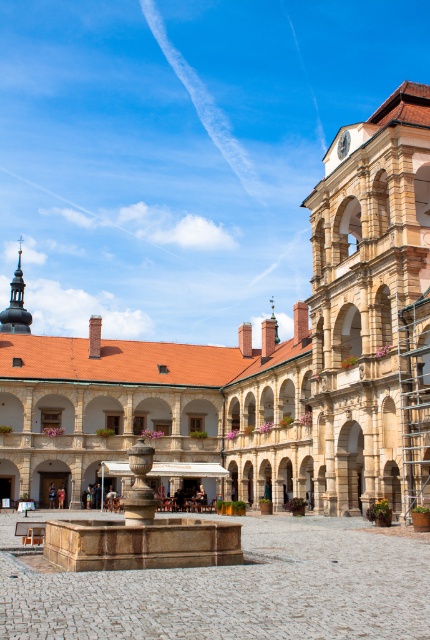
You are standing in the courtyard of the beige stone palace at center. You want to take a photo of the palace from a distance that is exactly 50 meters away. Is the current position you are standing at sufficient to achieve this?

The beige stone palace at center is 48.62 meters from camera, so you are already closer than 50 meters. To get exactly 50 meters away, you need to move back approximately 1.38 meters.

You are a tour guide leading a group through the courtyard. You want to ensure everyone can comfortably walk from the beige stone palace at center to the marble fountain at center. The widest wheelchair in your group is 32 inches wide. Is the path between them wide enough?

The distance between the beige stone palace at center and the marble fountain at center is 70.59 feet, which is approximately 847 inches. Since the widest wheelchair is only 32 inches wide, the path is more than sufficient in width to accommodate the wheelchair comfortably.